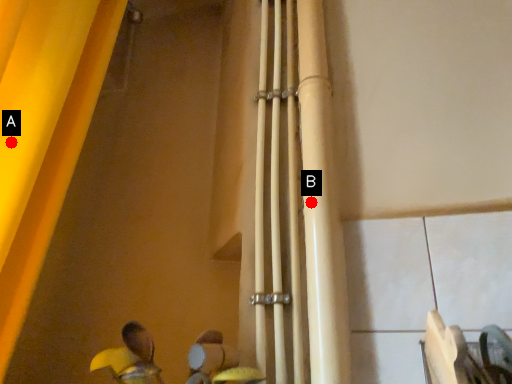
Question: Two points are circled on the image, labeled by A and B beside each circle. Which point is closer to the camera?

Choices:
 (A) A is closer
 (B) B is closer

Answer: (A)